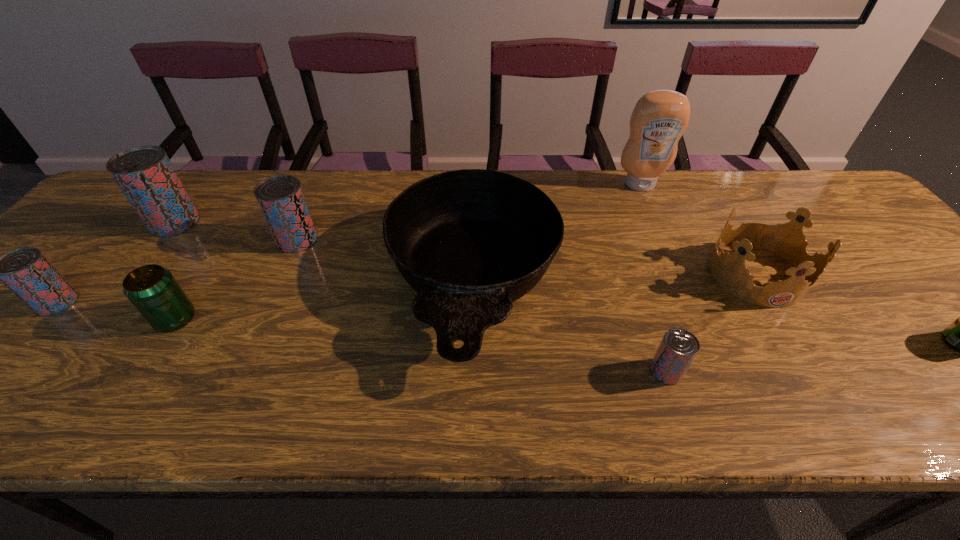
Image resolution: width=960 pixels, height=540 pixels. In order to click on the third biggest red beer can in this screenshot , I will do `click(25, 271)`.

Locate an element on the screen. the third beer can from left to right is located at coordinates (x=153, y=290).

Image resolution: width=960 pixels, height=540 pixels. Find the location of `the third object from left to right`. the third object from left to right is located at coordinates (153, 290).

Locate an element on the screen. The height and width of the screenshot is (540, 960). the smallest red beer can is located at coordinates (678, 348).

The width and height of the screenshot is (960, 540). I want to click on the sixth object from left to right, so click(678, 348).

Locate an element on the screen. Image resolution: width=960 pixels, height=540 pixels. free location located 0.330m on the label of the third object from right to left is located at coordinates [x=679, y=272].

Image resolution: width=960 pixels, height=540 pixels. In order to click on free location located 0.260m on the right of the second beer can from left to right in this screenshot , I will do [293, 222].

Identify the location of free region located 0.060m on the back of the third beer can from right to left. (309, 213).

In order to click on vacant area located 0.100m on the front-facing side of the second object from right to left in this screenshot , I will do `click(799, 345)`.

Where is `vacant area situated with the handle extending from the side of the fifth object from right to left`? This screenshot has height=540, width=960. vacant area situated with the handle extending from the side of the fifth object from right to left is located at coordinates (471, 424).